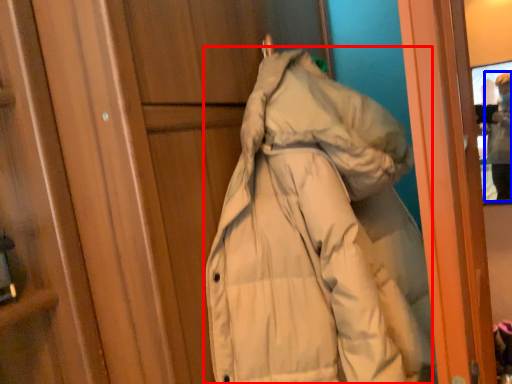
Question: Which of the following is the closest to the observer, coat (highlighted by a red box) or individual (highlighted by a blue box)?

Choices:
 (A) coat
 (B) individual

Answer: (A)